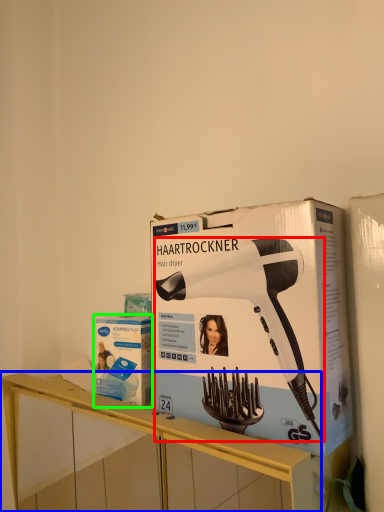
Question: Which object is positioned closest to hair drier (highlighted by a red box)? Select from furniture (highlighted by a blue box) and box (highlighted by a green box).

Choices:
 (A) furniture
 (B) box

Answer: (B)